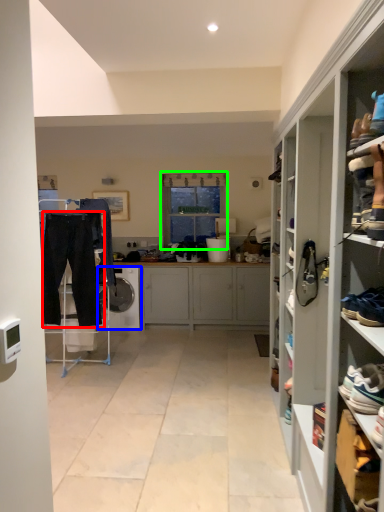
Question: Which object is the closest to the trousers (highlighted by a red box)? Choose among these: dish washer (highlighted by a blue box) or window (highlighted by a green box).

Choices:
 (A) dish washer
 (B) window

Answer: (A)